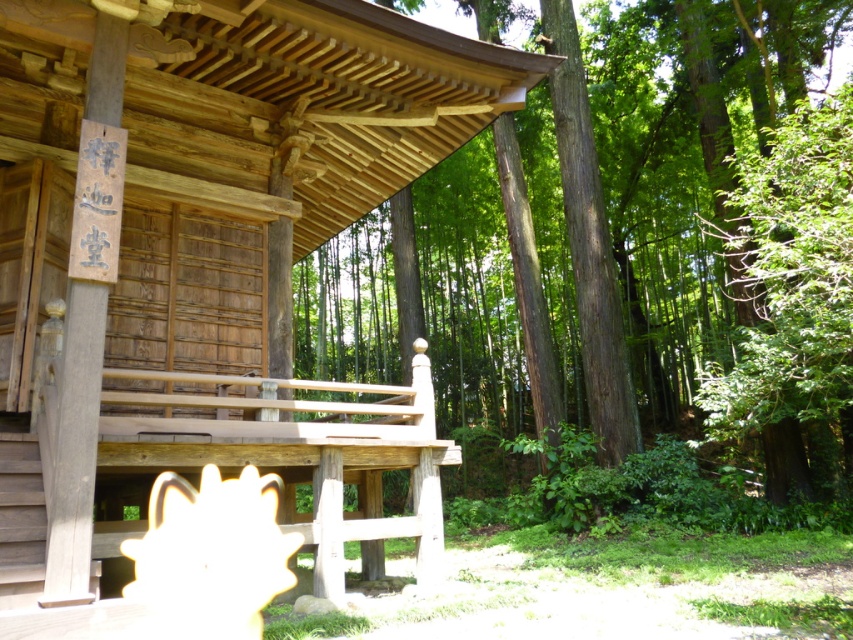
You are standing in front of the wooden cabin at center and the smooth brown tree trunk at center. Which object is nearer to you?

The wooden cabin at center is closer to the viewer than the smooth brown tree trunk at center, so the wooden cabin at center is nearer to you.

You are standing in front of the wooden cabin at center and the smooth brown tree trunk at center. If you turn to your right, which object will you see first?

The wooden cabin at center is positioned on the left side of the smooth brown tree trunk at center, so if you turn to your right, you will see the smooth brown tree trunk at center first.